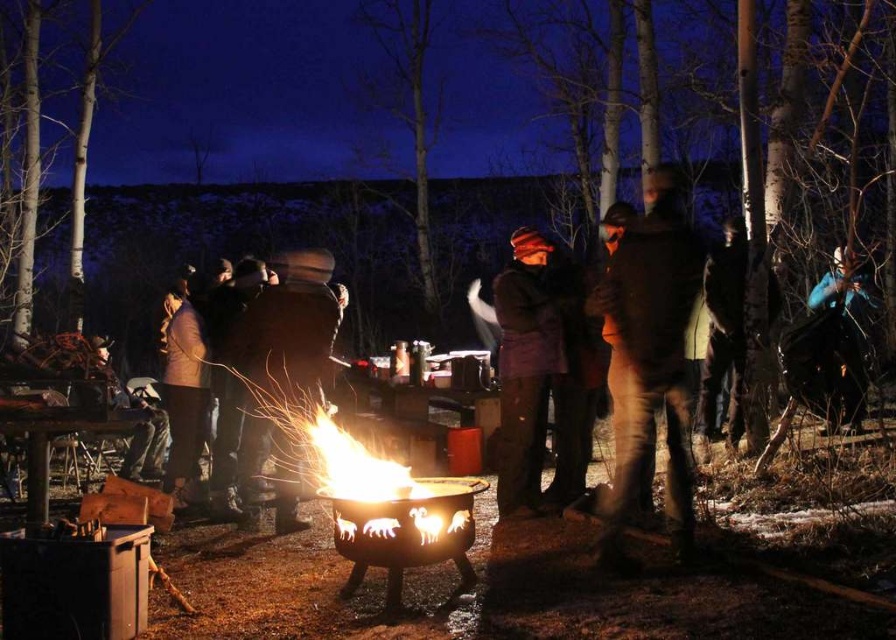
You are at the center of the gathering and want to hand a hot chocolate to the person wearing both the brown fuzzy jacket at center and the purple woolen hat at center. Since both items are on the same person, which one should you hand the drink to first?

You should hand the hot chocolate to the person wearing the brown fuzzy jacket at center first because the brown fuzzy jacket at center is to the right of the purple woolen hat at center, indicating it is closer to you from your perspective.

From the picture: You are standing at the center of the fire pit and want to hand a hot marshmallow to the person wearing the blue fabric jacket at right. In which direction should you move to reach them?

The blue fabric jacket at right is located at point 0.533 on the x axis and 0.940 on the y axis, so you should move towards the right and slightly upwards to reach them.

You are a photographer at the gathering and want to capture a wide shot of the scene. The blue fabric jacket at right and the metallic fire pit at center are both in your frame. Which object takes up more horizontal space in the photo?

The blue fabric jacket at right takes up more horizontal space in the photo because its width is larger than that of the metallic fire pit at center.